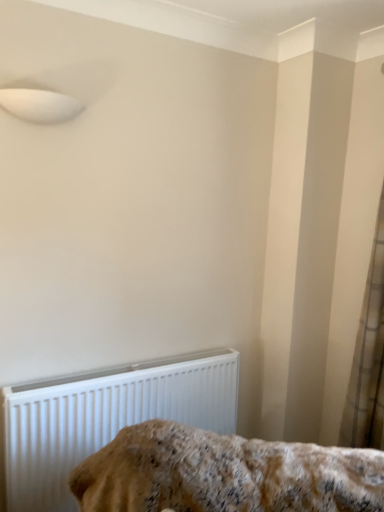
Question: Considering the positions of point (377, 332) and point (62, 421), is point (377, 332) closer or farther from the camera than point (62, 421)?

Choices:
 (A) farther
 (B) closer

Answer: (A)

Question: In the image, is white sheer curtain at right positioned in front of or behind white plastic radiator at lower left?

Choices:
 (A) behind
 (B) front

Answer: (A)

Question: Estimate the real-world distances between objects in this image. Which object is farther from the white plastic radiator at lower left?

Choices:
 (A) white sheer curtain at right
 (B) fluffy beige blanket at lower center

Answer: (A)

Question: Which of these objects is positioned closest to the white plastic radiator at lower left?

Choices:
 (A) fluffy beige blanket at lower center
 (B) white sheer curtain at right

Answer: (A)